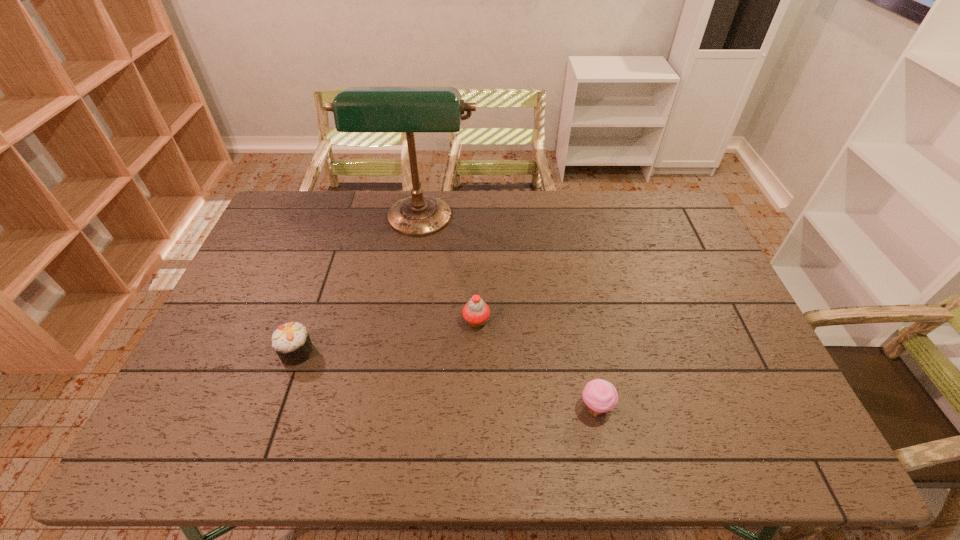
I want to click on free space located 0.260m on the back of the leftmost object, so click(x=324, y=272).

Where is `vacant region located 0.190m on the left of the nearest cupcake`? Image resolution: width=960 pixels, height=540 pixels. vacant region located 0.190m on the left of the nearest cupcake is located at coordinates (501, 408).

At what (x,y) coordinates should I click in order to perform the action: click on object present at the far edge. Please return your answer as a coordinate pair (x, y). The image size is (960, 540). Looking at the image, I should click on 357,109.

Identify the location of free region at the far edge of the desktop. (368, 195).

In the image, there is a desktop. Where is `free space at the near edge`? free space at the near edge is located at coordinates (306, 451).

Where is `vacant space at the left edge`? Image resolution: width=960 pixels, height=540 pixels. vacant space at the left edge is located at coordinates (254, 263).

Locate an element on the screen. vacant space at the far left corner of the desktop is located at coordinates (287, 194).

Find the location of a particular element. This screenshot has height=540, width=960. vacant space at the far right corner of the desktop is located at coordinates (663, 200).

Locate an element on the screen. This screenshot has width=960, height=540. free space at the near right corner is located at coordinates (798, 456).

Where is `free space between the leftmost object and the rightmost cupcake`? free space between the leftmost object and the rightmost cupcake is located at coordinates (446, 380).